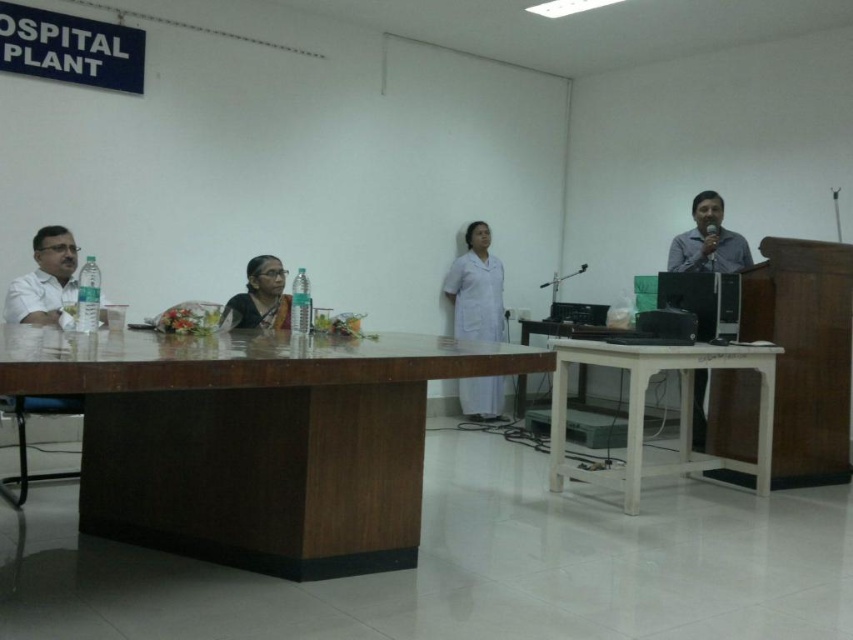
You are a guest entering the room and want to sit next to the satin black saree at center. Which side of the white wooden table at right should you choose?

The white wooden table at right is to the right of the satin black saree at center, so you should choose the left side of the white wooden table at right to sit next to the saree.

You are standing in the conference room and need to locate two specific points marked on the table. Which of the two points, point [730,467] or point [492,275], is closer to your current position?

Point [730,467] is closer to the camera than point [492,275], so it is closer to your current position.